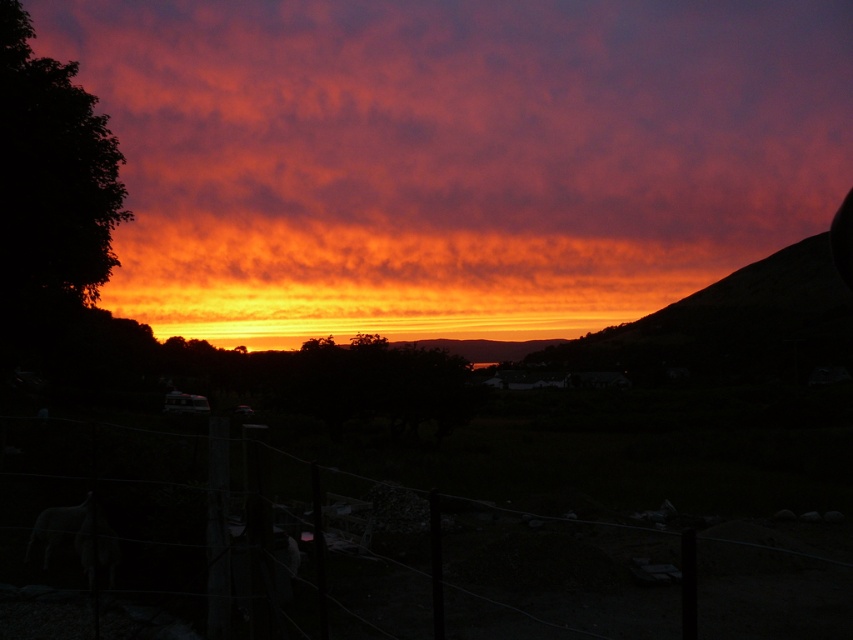
Question: Is cloudy orange sky at upper center wider than wire mesh fence at lower center?

Choices:
 (A) no
 (B) yes

Answer: (B)

Question: Which point appears farthest from the camera in this image?

Choices:
 (A) (776, 115)
 (B) (355, 499)

Answer: (A)

Question: Which of the following is the farthest from the observer?

Choices:
 (A) cloudy orange sky at upper center
 (B) wire mesh fence at lower center

Answer: (A)

Question: Which point appears closest to the camera in this image?

Choices:
 (A) (22, 563)
 (B) (396, 292)

Answer: (A)

Question: In this image, where is cloudy orange sky at upper center located relative to wire mesh fence at lower center?

Choices:
 (A) above
 (B) below

Answer: (A)

Question: Can you confirm if cloudy orange sky at upper center is bigger than wire mesh fence at lower center?

Choices:
 (A) no
 (B) yes

Answer: (B)